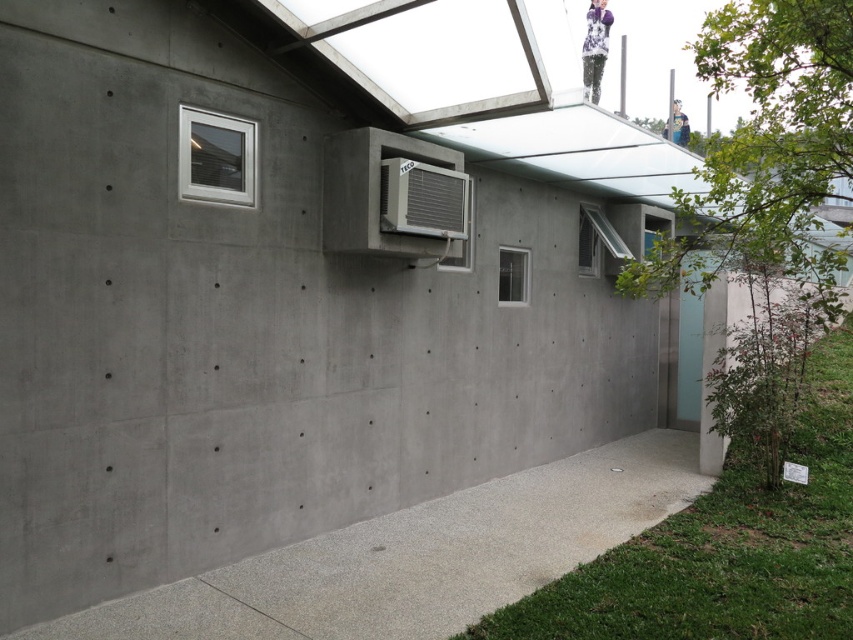
In the scene shown: You are an architect designing a new building and want to ensure that the clear glass window at center and the clear glass window at upper right are appropriately sized. Based on the scene, which window is wider?

The clear glass window at upper right is wider than the clear glass window at center.

You are an architect designing a new building and want to ensure structural integrity. Which of the two windows, the white plastic window at upper left or the clear glass window at upper right, has a greater thickness to better support the roof structure?

The clear glass window at upper right has a greater thickness than the white plastic window at upper left, making it better suited for supporting the roof structure.